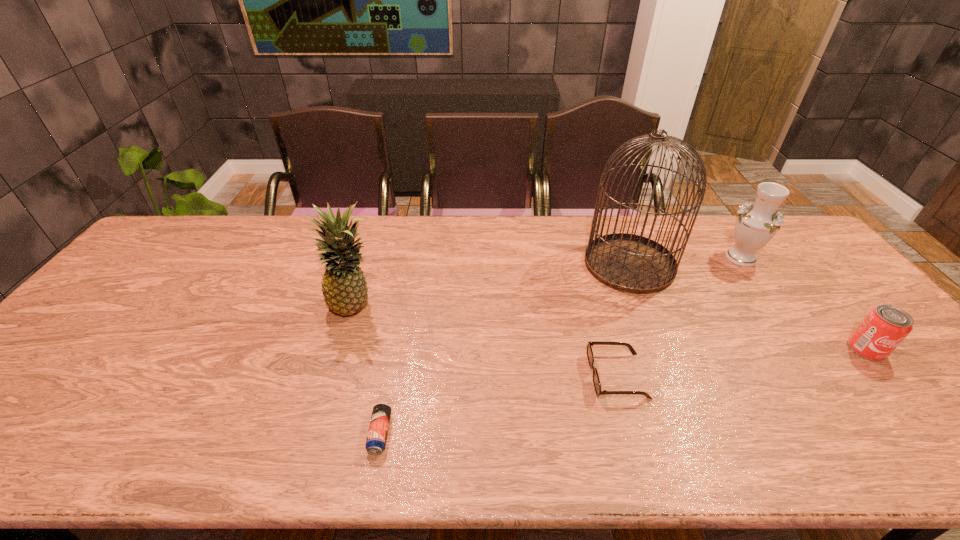
At what (x,y) coordinates should I click in order to perform the action: click on blank space that satisfies the following two spatial constraints: 1. on the front side of the rightmost object; 2. on the front-facing side of the sunglasses. Please return your answer as a coordinate pair (x, y). Looking at the image, I should click on (889, 376).